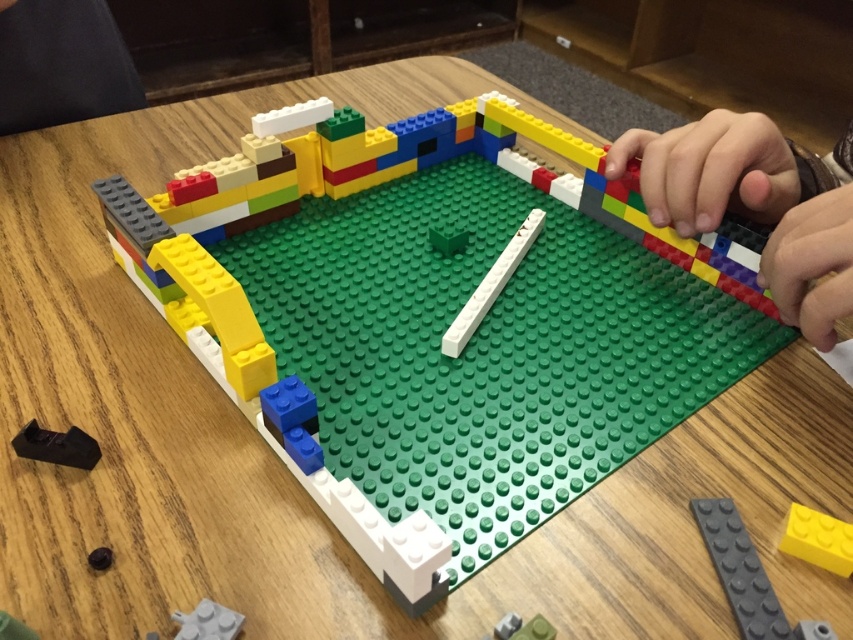
You are a robot arm trying to reach from the smooth plastic hand at upper right to the matte black lego piece at lower left. The robot arm has a maximum reach of 50 centimeters. Can you reach it?

The distance between the smooth plastic hand at upper right and the matte black lego piece at lower left is 48.34 centimeters, which is within the robot arm maximum reach of 50 centimeters. Yes, the robot arm can reach it.

You are trying to locate the black plastic piece at lower left on the table. According to the coordinates provided, where exactly is it positioned?

The black plastic piece at lower left is located at point (56, 445).